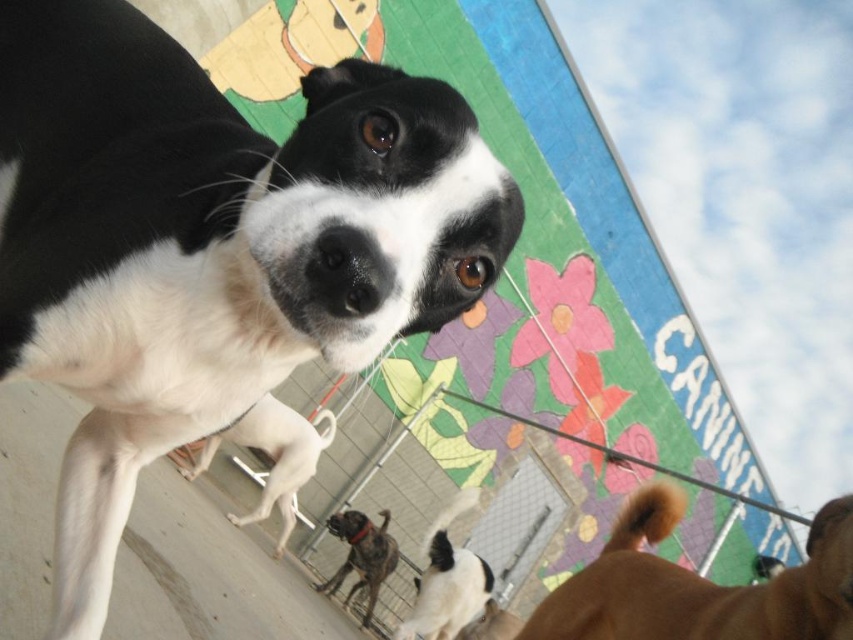
How much distance is there between black and white fur at center and black matte nose at center?

11.90 inches

Is point (242, 332) closer to viewer compared to point (374, 301)?

No, it is not.

Find the location of a particular element. black and white fur at center is located at coordinates (207, 250).

The width and height of the screenshot is (853, 640). Describe the element at coordinates (207, 250) in the screenshot. I see `black and white fur at center` at that location.

Between point (294, 484) and point (376, 589), which one is positioned in front?

Point (294, 484) is more forward.

The width and height of the screenshot is (853, 640). I want to click on black and white fur at center, so click(207, 250).

Locate an element on the screen. The width and height of the screenshot is (853, 640). black and white fur at center is located at coordinates (207, 250).

Does white smooth dog at center appear on the left side of brindle fur dog at center?

Indeed, white smooth dog at center is positioned on the left side of brindle fur dog at center.

Between white smooth dog at center and brindle fur dog at center, which one has more height?

Standing taller between the two is white smooth dog at center.

Does point (270, 477) come closer to viewer compared to point (381, 541)?

Yes, point (270, 477) is closer to viewer.

Image resolution: width=853 pixels, height=640 pixels. Identify the location of white smooth dog at center. (273, 456).